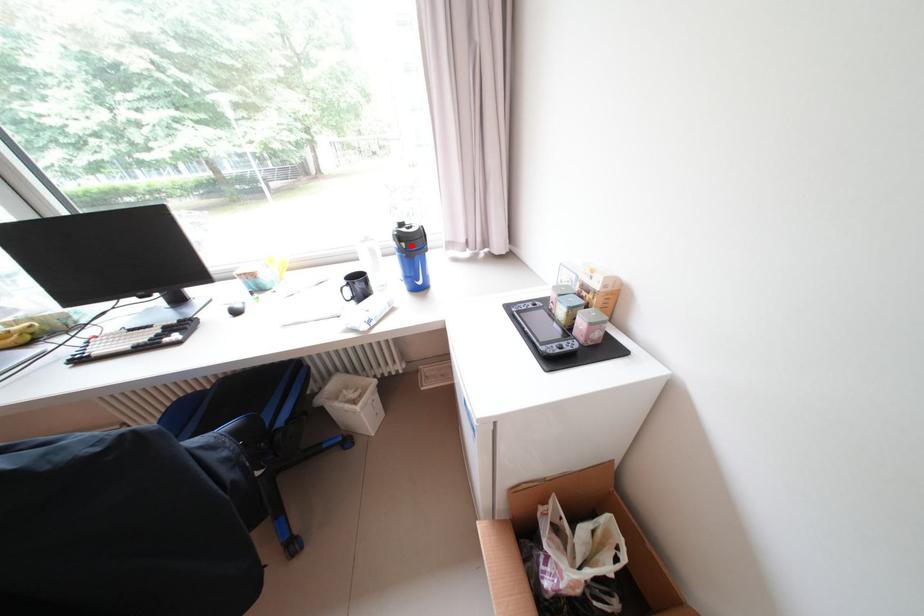
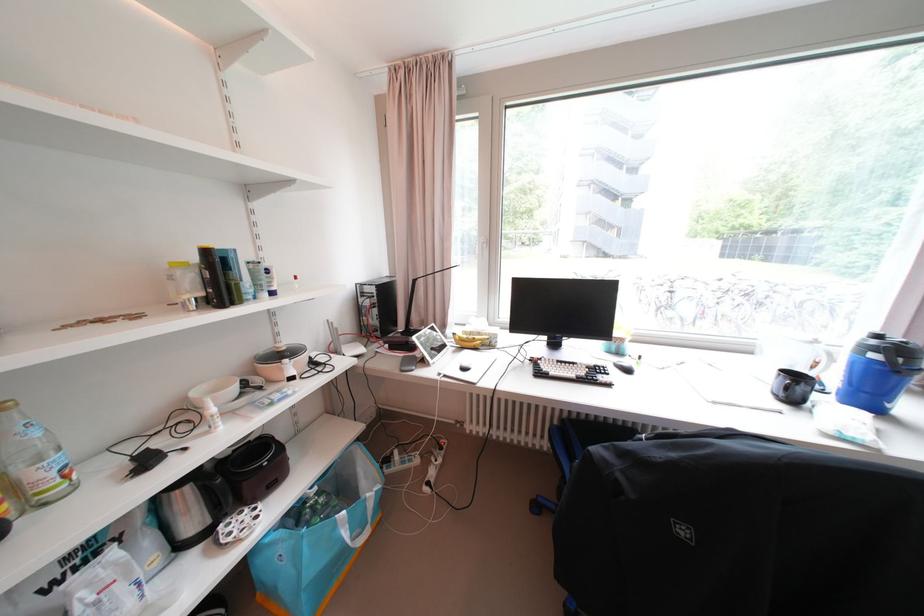
Question: I am providing you with two images of the same scene from different viewpoints. A red point is shown in image1. For the corresponding object point in image2, is it positioned nearer or farther from the camera?

Choices:
 (A) Nearer
 (B) Farther

Answer: (A)